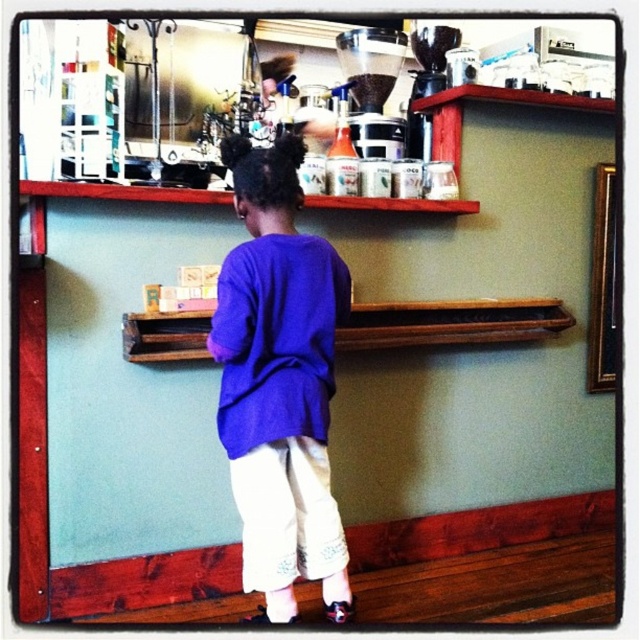
You are a barista working in the coffee shop. You need to reach the matte black coffee grinder at upper center to grind some beans. However, the child wearing the purple cotton shirt at center is blocking your path. Can you move around the child to access the grinder?

The purple cotton shirt at center is positioned on the left side of the matte black coffee grinder at upper center, so you can move around the child to the right side to access the grinder.

You are a delivery person who needs to place a new coffee grinder that is 100 centimeters in height into the space between the purple cotton shirt at center and the matte black coffee grinder at upper center. Can the new coffee grinder fit in that space?

The distance between the purple cotton shirt at center and the matte black coffee grinder at upper center is 88.45 centimeters. Since the new coffee grinder is 100 centimeters tall, it cannot fit in the space between them as it is taller than the available distance.

You are a customer in a coffee shop and you want to reach the matte black coffee grinder at upper center on the shelf. You are wearing a purple cotton shirt at center. Will your shirt get in the way when you try to reach the coffee grinder?

The purple cotton shirt at center is positioned under the matte black coffee grinder at upper center, so when reaching up, the shirt should not obstruct access to the grinder as it is below it.